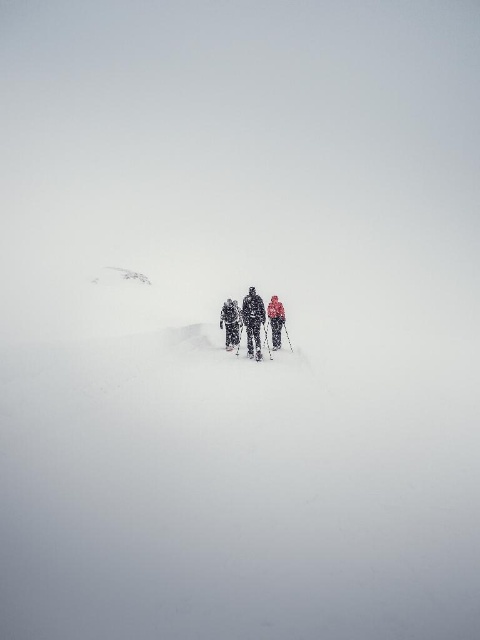
You are a photographer standing in the snowy landscape. You want to take a photo of both the dark gray ski suit at center and the red fabric jacket at center in the same frame. Considering their current positions, can you capture both in a single shot without moving your camera? Explain your reasoning.

The dark gray ski suit at center and red fabric jacket at center are 4.68 meters apart. Since the photographer is in the snowy landscape and the distance between them is 4.68 meters, it depends on the camera lens used. A wide angle lens might capture both if they are within the field of view, but without specific lens details, it is uncertain. However, given typical camera capabilities, it is possible to frame both in one shot if positioned correctly.